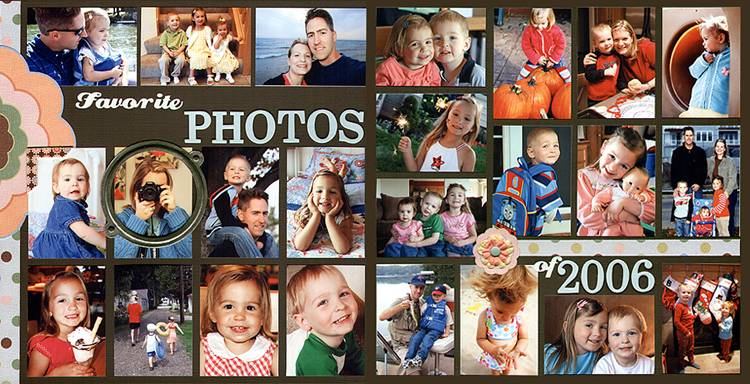
Where is `christmas stockings`? The width and height of the screenshot is (750, 384). christmas stockings is located at coordinates (726, 286), (708, 286), (687, 281), (670, 286).